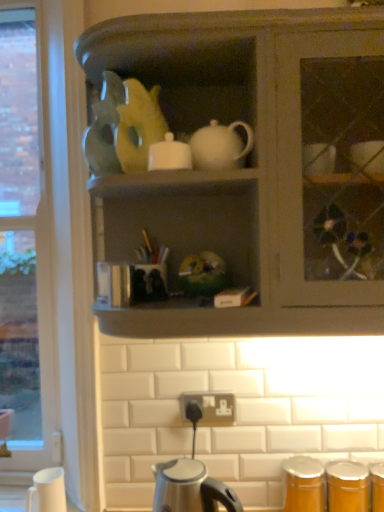
In order to face white matte coffee cup at lower left, should I rotate leftwards or rightwards?

Rotate your view left by about 18.438°.

Find the location of a particular element. The width and height of the screenshot is (384, 512). satin silver kettle at lower center is located at coordinates pyautogui.click(x=190, y=488).

You are a GUI agent. You are given a task and a screenshot of the screen. Output one action in this format:
    pyautogui.click(x=<x>, y=<y>)
    Task: Click on the white glossy sugar bowl at upper center
    This screenshot has width=384, height=512.
    Given the screenshot: What is the action you would take?
    pyautogui.click(x=169, y=154)

What do you see at coordinates (324, 485) in the screenshot? I see `matte orange canister at lower right` at bounding box center [324, 485].

Where is `white matte coffee cup at lower left`? Image resolution: width=384 pixels, height=512 pixels. white matte coffee cup at lower left is located at coordinates (48, 490).

Is white glossy sugar bowl at upper center with satin silver kettle at lower center?

No, white glossy sugar bowl at upper center is not making contact with satin silver kettle at lower center.

From the picture: Is white glossy sugar bowl at upper center oriented towards satin silver kettle at lower center?

No.

Is point (158, 166) positioned before point (156, 492)?

Yes, point (158, 166) is in front of point (156, 492).

Based on the photo, from a real-world perspective, is white glossy sugar bowl at upper center physically located above or below satin silver kettle at lower center?

In terms of real-world spatial position, white glossy sugar bowl at upper center is above satin silver kettle at lower center.

Between matte orange canister at lower right and white matte coffee cup at lower left, which one has less height?

white matte coffee cup at lower left.

In terms of width, does matte orange canister at lower right look wider or thinner when compared to white matte coffee cup at lower left?

matte orange canister at lower right is wider than white matte coffee cup at lower left.

Is point (333, 509) positioned before point (60, 506)?

No, it is behind (60, 506).

Which of these two, matte gray cabinet at center or matte orange canister at lower right, is bigger?

matte gray cabinet at center is bigger.

From a real-world perspective, who is located lower, matte gray cabinet at center or matte orange canister at lower right?

matte orange canister at lower right.

Considering the sizes of matte gray cabinet at center and matte orange canister at lower right in the image, is matte gray cabinet at center wider or thinner than matte orange canister at lower right?

In the image, matte gray cabinet at center appears to be wider than matte orange canister at lower right.

Is point (356, 114) positioned behind point (315, 462)?

No, (356, 114) is in front of (315, 462).

Is white matte coffee cup at lower left smaller than white glossy sugar bowl at upper center?

No, white matte coffee cup at lower left is not smaller than white glossy sugar bowl at upper center.

Which point is more forward, [57,480] or [168,148]?

The point [168,148] is more forward.

Is white matte coffee cup at lower left surrounding white glossy sugar bowl at upper center?

That's incorrect, white glossy sugar bowl at upper center is not inside white matte coffee cup at lower left.

Does white glossy sugar bowl at upper center have a greater width compared to matte gray cabinet at center?

No.

Considering the relative positions of white glossy sugar bowl at upper center and matte gray cabinet at center in the image provided, is white glossy sugar bowl at upper center to the left of matte gray cabinet at center from the viewer's perspective?

Correct, you'll find white glossy sugar bowl at upper center to the left of matte gray cabinet at center.

Which is more distant, (157, 159) or (250, 170)?

The point (250, 170) is farther.

Is white matte coffee cup at lower left surrounded by white glossy sugar bowl at upper center?

No, white matte coffee cup at lower left is not a part of white glossy sugar bowl at upper center.

From a real-world perspective, between white glossy sugar bowl at upper center and white matte coffee cup at lower left, who is vertically higher?

white glossy sugar bowl at upper center, from a real-world perspective.

In terms of height, does white glossy sugar bowl at upper center look taller or shorter compared to white matte coffee cup at lower left?

white glossy sugar bowl at upper center is shorter than white matte coffee cup at lower left.

Which object is closer to the camera taking this photo, white glossy sugar bowl at upper center or white matte coffee cup at lower left?

white glossy sugar bowl at upper center is in front.

From the picture: Which object is further away from the camera, satin silver kettle at lower center or white glossy sugar bowl at upper center?

white glossy sugar bowl at upper center is behind.

Which is in front, point (185, 489) or point (184, 168)?

The point (185, 489) is closer to the camera.

From a real-world perspective, is satin silver kettle at lower center located beneath white glossy sugar bowl at upper center?

Yes.

Consider the image. Between satin silver kettle at lower center and white glossy sugar bowl at upper center, which one appears on the right side from the viewer's perspective?

Positioned to the right is satin silver kettle at lower center.

In the image, there is a white glossy sugar bowl at upper center. Where is `kettle below it (from a real-world perspective)`? kettle below it (from a real-world perspective) is located at coordinates (190, 488).

I want to click on coffee cup behind the matte orange canister at lower right, so click(48, 490).

Considering their positions, is matte gray cabinet at center positioned further to white glossy sugar bowl at upper center than matte orange canister at lower right?

matte orange canister at lower right is positioned further to the anchor white glossy sugar bowl at upper center.

Estimate the real-world distances between objects in this image. Which object is further from white glossy sugar bowl at upper center, matte orange canister at lower right or white matte coffee cup at lower left?

Based on the image, white matte coffee cup at lower left appears to be further to white glossy sugar bowl at upper center.

Looking at the image, which one is located further to matte orange canister at lower right, white glossy sugar bowl at upper center or white matte coffee cup at lower left?

Based on the image, white glossy sugar bowl at upper center appears to be further to matte orange canister at lower right.

Considering their positions, is matte gray cabinet at center positioned further to white matte coffee cup at lower left than white glossy sugar bowl at upper center?

matte gray cabinet at center is further to white matte coffee cup at lower left.

Looking at the image, which one is located closer to matte orange canister at lower right, white matte coffee cup at lower left or matte gray cabinet at center?

white matte coffee cup at lower left.

Looking at the image, which one is located closer to satin silver kettle at lower center, white matte coffee cup at lower left or matte gray cabinet at center?

white matte coffee cup at lower left is closer to satin silver kettle at lower center.

Looking at the image, which one is located further to matte orange canister at lower right, satin silver kettle at lower center or white matte coffee cup at lower left?

The object further to matte orange canister at lower right is white matte coffee cup at lower left.

From the picture: Considering their positions, is matte gray cabinet at center positioned further to satin silver kettle at lower center than white glossy sugar bowl at upper center?

white glossy sugar bowl at upper center is further to satin silver kettle at lower center.

You are a GUI agent. You are given a task and a screenshot of the screen. Output one action in this format:
    pyautogui.click(x=<x>, y=<y>)
    Task: Click on the kettle between matte gray cabinet at center and matte orange canister at lower right vertically
    The height and width of the screenshot is (512, 384).
    Given the screenshot: What is the action you would take?
    pyautogui.click(x=190, y=488)

Where is `kettle between matte gray cabinet at center and white matte coffee cup at lower left in the vertical direction`? kettle between matte gray cabinet at center and white matte coffee cup at lower left in the vertical direction is located at coordinates (190, 488).

What are the coordinates of `kettle between white matte coffee cup at lower left and matte orange canister at lower right` in the screenshot? It's located at (190, 488).

Where is `kettle between white glossy sugar bowl at upper center and matte orange canister at lower right from top to bottom`? kettle between white glossy sugar bowl at upper center and matte orange canister at lower right from top to bottom is located at coordinates (190, 488).